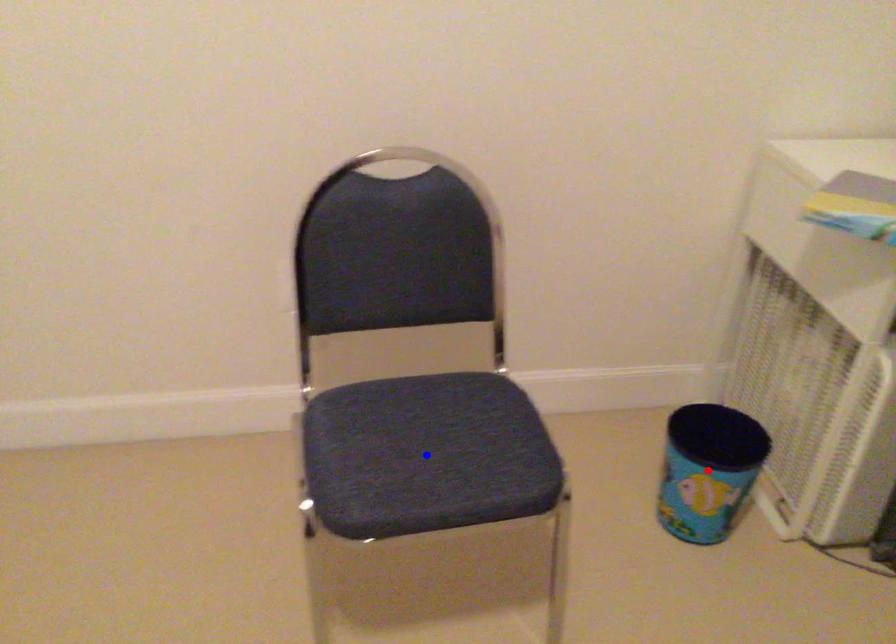
Question: In the image, two points are highlighted. Which point is nearer to the camera? Reply with the corresponding letter.

Choices:
 (A) blue point
 (B) red point

Answer: (A)